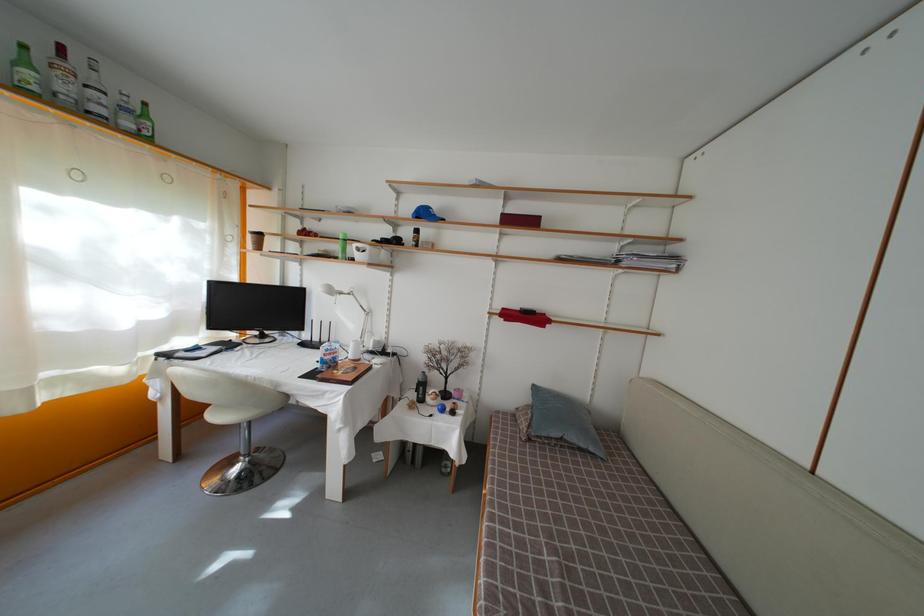
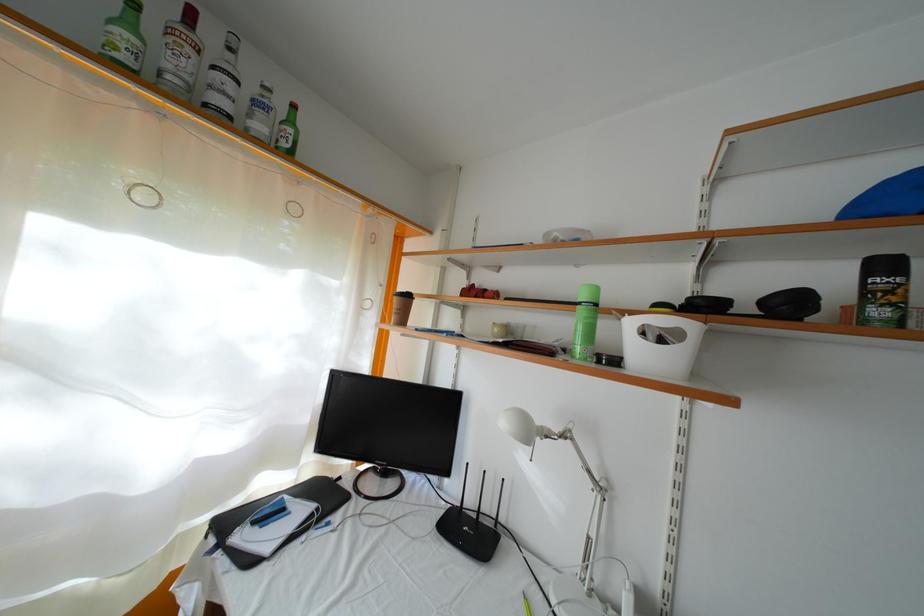
Find the pixel in the second image that matches point (134, 131) in the first image.

(264, 134)